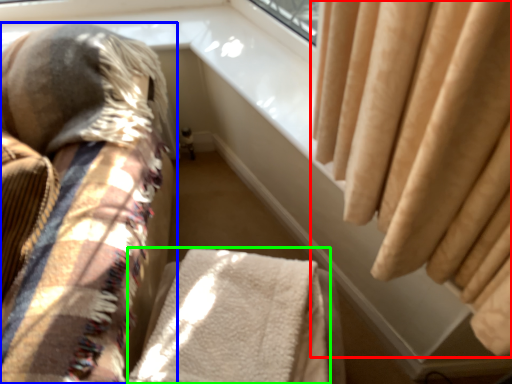
Question: Which is nearer to the curtain (highlighted by a red box)? furniture (highlighted by a blue box) or blanket (highlighted by a green box).

Choices:
 (A) furniture
 (B) blanket

Answer: (B)